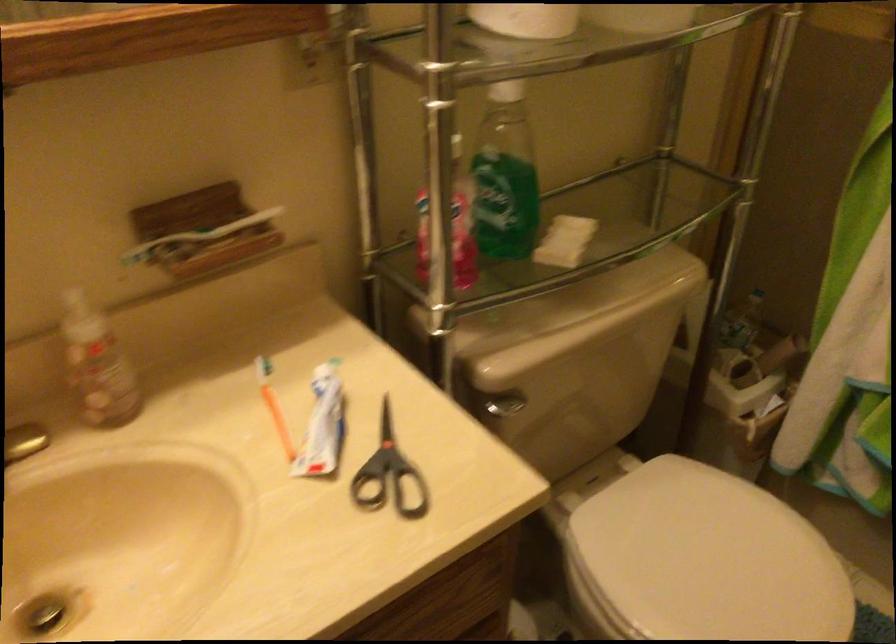
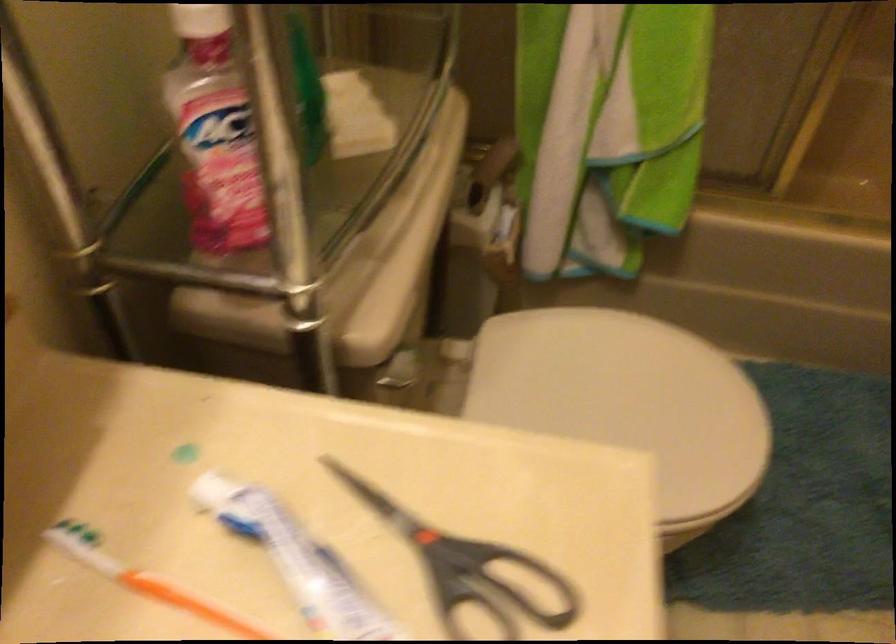
Based on the continuous images, in which direction is the camera rotating?

The rotation direction of the camera is right-down.